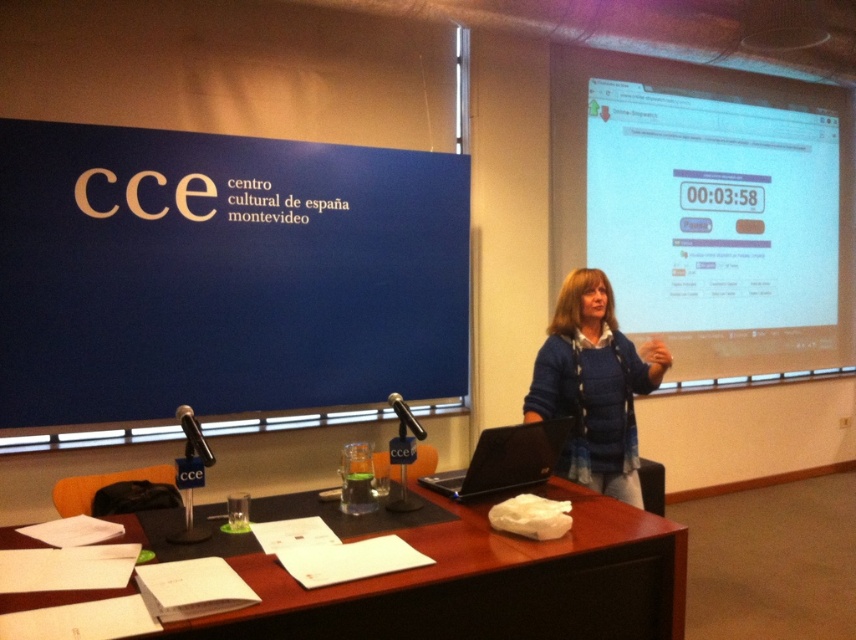
Is blue knitted sweater at center behind black plastic laptop at center?

Yes, blue knitted sweater at center is behind black plastic laptop at center.

Looking at this image, does blue knitted sweater at center appear on the left side of black plastic laptop at center?

Incorrect, blue knitted sweater at center is not on the left side of black plastic laptop at center.

Who is more distant from viewer, (x=590, y=380) or (x=515, y=445)?

Positioned behind is point (x=590, y=380).

I want to click on blue knitted sweater at center, so click(x=593, y=387).

Can you confirm if white glossy projection screen at upper right is positioned below brown wooden table at center?

Actually, white glossy projection screen at upper right is above brown wooden table at center.

Is white glossy projection screen at upper right smaller than brown wooden table at center?

No, white glossy projection screen at upper right is not smaller than brown wooden table at center.

Which is in front, point (599, 189) or point (467, 604)?

Point (467, 604) is more forward.

What are the coordinates of `white glossy projection screen at upper right` in the screenshot? It's located at (706, 209).

Does point (800, 234) come farther from viewer compared to point (489, 460)?

Yes, point (800, 234) is behind point (489, 460).

Is the position of white glossy projection screen at upper right more distant than that of black plastic laptop at center?

Yes.

Which is in front, point (639, 115) or point (554, 422)?

Point (554, 422) is more forward.

Identify the location of white glossy projection screen at upper right. point(706,209).